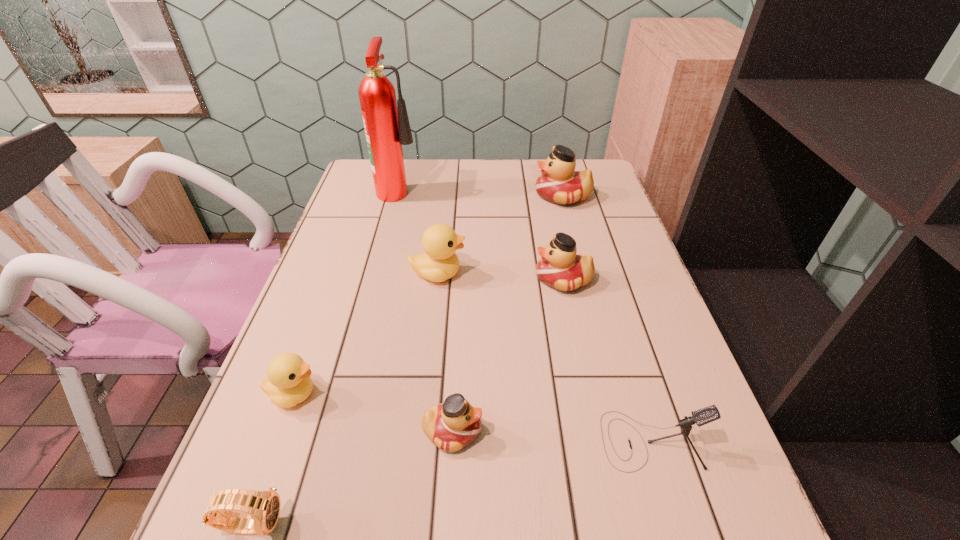
This screenshot has height=540, width=960. Identify the location of vacant space situated on the face of the left yellow duck. (362, 394).

The width and height of the screenshot is (960, 540). I want to click on vacant region located 0.180m on the stand of the microphone, so click(502, 441).

I want to click on vacant area situated on the stand of the microphone, so click(x=429, y=441).

This screenshot has width=960, height=540. Identify the location of vacant area situated 0.120m on the stand of the microphone. (536, 441).

Identify the location of vacant space located on the face of the leftmost red duck. (658, 431).

Where is `fire extinguisher at the far edge`? The width and height of the screenshot is (960, 540). fire extinguisher at the far edge is located at coordinates (387, 128).

Find the location of `duck present at the far edge`. duck present at the far edge is located at coordinates (559, 183).

The image size is (960, 540). Identify the location of fire extinguisher situated at the left edge. (387, 128).

I want to click on duck that is at the left edge, so click(289, 383).

Identify the location of microphone that is positioned at the right edge. (703, 416).